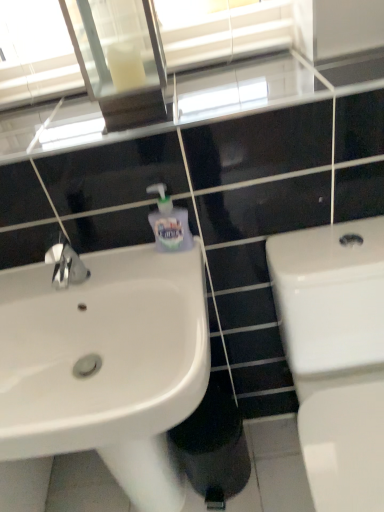
Identify the location of vacant space to the left of translucent plastic soap dispenser at upper center. The width and height of the screenshot is (384, 512). (115, 265).